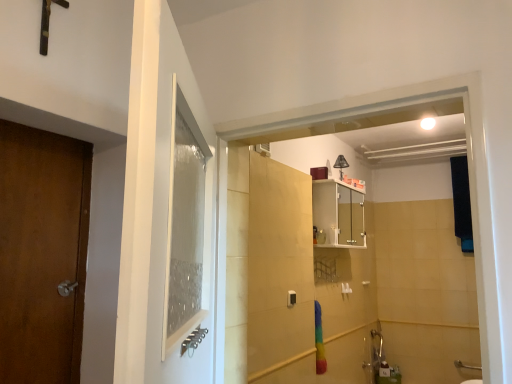
At what (x,y) coordinates should I click in order to perform the action: click on matte black lampshade at upper center. Please return your answer as a coordinate pair (x, y). Looking at the image, I should click on (341, 164).

The height and width of the screenshot is (384, 512). Describe the element at coordinates (341, 164) in the screenshot. I see `matte black lampshade at upper center` at that location.

Measure the distance between matte black lampshade at upper center and camera.

matte black lampshade at upper center is 9.18 feet away from camera.

Measure the distance between white glossy cabinet at upper center and camera.

2.66 meters.

Locate an element on the screen. The height and width of the screenshot is (384, 512). white glossy cabinet at upper center is located at coordinates (338, 214).

What do you see at coordinates (338, 214) in the screenshot?
I see `white glossy cabinet at upper center` at bounding box center [338, 214].

At what (x,y) coordinates should I click in order to perform the action: click on matte black lampshade at upper center. Please return your answer as a coordinate pair (x, y). The image size is (512, 384). Looking at the image, I should click on (341, 164).

Which is more to the left, matte black lampshade at upper center or white glossy cabinet at upper center?

Positioned to the left is white glossy cabinet at upper center.

Looking at this image, is matte black lampshade at upper center positioned behind white glossy cabinet at upper center?

Yes.

Which is behind, point (341, 167) or point (346, 223)?

The point (346, 223) is more distant.

From the image's perspective, which is below, matte black lampshade at upper center or white glossy cabinet at upper center?

white glossy cabinet at upper center appears lower in the image.

From a real-world perspective, which object rests below the other?

In real-world perspective, white glossy cabinet at upper center is lower.

Which object is thinner, matte black lampshade at upper center or white glossy cabinet at upper center?

matte black lampshade at upper center.

Can you confirm if matte black lampshade at upper center is shorter than white glossy cabinet at upper center?

Correct, matte black lampshade at upper center is not as tall as white glossy cabinet at upper center.

In the scene shown: Which of these two, matte black lampshade at upper center or white glossy cabinet at upper center, is smaller?

With smaller size is matte black lampshade at upper center.

Would you say matte black lampshade at upper center is inside or outside white glossy cabinet at upper center?

matte black lampshade at upper center is located beyond the bounds of white glossy cabinet at upper center.

Is matte black lampshade at upper center beside white glossy cabinet at upper center?

There is a gap between matte black lampshade at upper center and white glossy cabinet at upper center.

From the picture: Is matte black lampshade at upper center facing away from white glossy cabinet at upper center?

That's not correct — matte black lampshade at upper center is not looking away from white glossy cabinet at upper center.

How far apart are matte black lampshade at upper center and white glossy cabinet at upper center?

matte black lampshade at upper center and white glossy cabinet at upper center are 18.91 inches apart from each other.

You are a GUI agent. You are given a task and a screenshot of the screen. Output one action in this format:
    pyautogui.click(x=<x>, y=<y>)
    Task: Click on the cabinetry below the matte black lampshade at upper center (from the image's perspective)
    
    Given the screenshot: What is the action you would take?
    tap(338, 214)

Is white glossy cabinet at upper center to the left of matte black lampshade at upper center from the viewer's perspective?

Correct, you'll find white glossy cabinet at upper center to the left of matte black lampshade at upper center.

In the image, is white glossy cabinet at upper center positioned in front of or behind matte black lampshade at upper center?

white glossy cabinet at upper center is in front of matte black lampshade at upper center.

Does point (361, 210) lie behind point (341, 170)?

Yes, point (361, 210) is behind point (341, 170).

From the image's perspective, which is above, white glossy cabinet at upper center or matte black lampshade at upper center?

matte black lampshade at upper center, from the image's perspective.

From a real-world perspective, who is located lower, white glossy cabinet at upper center or matte black lampshade at upper center?

In real-world perspective, white glossy cabinet at upper center is lower.

Is white glossy cabinet at upper center wider or thinner than matte black lampshade at upper center?

Considering their sizes, white glossy cabinet at upper center looks broader than matte black lampshade at upper center.

Considering the relative sizes of white glossy cabinet at upper center and matte black lampshade at upper center in the image provided, is white glossy cabinet at upper center taller than matte black lampshade at upper center?

Correct, white glossy cabinet at upper center is much taller as matte black lampshade at upper center.

Looking at this image, considering the sizes of objects white glossy cabinet at upper center and matte black lampshade at upper center in the image provided, who is bigger, white glossy cabinet at upper center or matte black lampshade at upper center?

white glossy cabinet at upper center is bigger.

Is white glossy cabinet at upper center spatially inside matte black lampshade at upper center, or outside of it?

white glossy cabinet at upper center cannot be found inside matte black lampshade at upper center.

Would you consider white glossy cabinet at upper center to be distant from matte black lampshade at upper center?

No, white glossy cabinet at upper center is in close proximity to matte black lampshade at upper center.

Does white glossy cabinet at upper center turn towards matte black lampshade at upper center?

No, white glossy cabinet at upper center is not oriented towards matte black lampshade at upper center.

What are the coordinates of `cabinetry located underneath the matte black lampshade at upper center (from a real-world perspective)` in the screenshot? It's located at (338, 214).

Image resolution: width=512 pixels, height=384 pixels. In order to click on cabinetry that is under the matte black lampshade at upper center (from a real-world perspective) in this screenshot , I will do tap(338, 214).

The image size is (512, 384). Find the location of `cabinetry on the left of matte black lampshade at upper center`. cabinetry on the left of matte black lampshade at upper center is located at coordinates (338, 214).